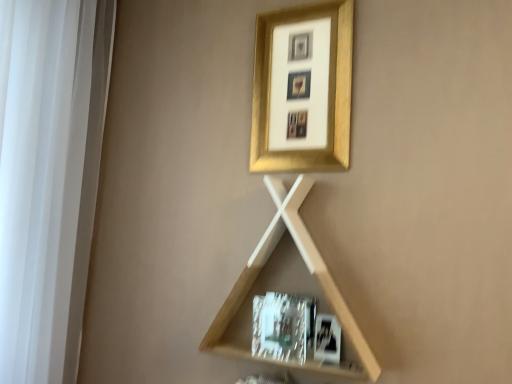
What is the approximate height of white fabric at left?

It is 1.11 meters.

What do you see at coordinates (327, 339) in the screenshot?
I see `metallic silver picture frame at lower right, the 1th picture frame when ordered from front to back` at bounding box center [327, 339].

The image size is (512, 384). Identify the location of metallic silver picture frame at lower right, the second picture frame in the back-to-front sequence. (327, 339).

Where is `gold metallic picture frame at upper center, positioned as the 1th picture frame in back-to-front order`? This screenshot has width=512, height=384. gold metallic picture frame at upper center, positioned as the 1th picture frame in back-to-front order is located at coordinates (303, 89).

Is gold metallic picture frame at upper center, the 2th picture frame in the bottom-to-top sequence, inside the boundaries of light wood/texture shelf at center, or outside?

gold metallic picture frame at upper center, the 2th picture frame in the bottom-to-top sequence, is outside light wood/texture shelf at center.

From the image's perspective, is gold metallic picture frame at upper center, which appears as the 1th picture frame when viewed from the top, located beneath light wood/texture shelf at center?

No.

Can you confirm if gold metallic picture frame at upper center, positioned as the second picture frame in front-to-back order, is taller than light wood/texture shelf at center?

In fact, gold metallic picture frame at upper center, positioned as the second picture frame in front-to-back order, may be shorter than light wood/texture shelf at center.

Does gold metallic picture frame at upper center, which appears as the 1th picture frame when viewed from the top, appear on the right side of light wood/texture shelf at center?

Correct, you'll find gold metallic picture frame at upper center, which appears as the 1th picture frame when viewed from the top, to the right of light wood/texture shelf at center.

Considering the points (70, 62) and (280, 52), which point is behind, point (70, 62) or point (280, 52)?

Point (70, 62)

Considering the positions of objects white fabric at left and gold metallic picture frame at upper center, which appears as the 1th picture frame when viewed from the top, in the image provided, who is more to the right, white fabric at left or gold metallic picture frame at upper center, which appears as the 1th picture frame when viewed from the top,?

From the viewer's perspective, gold metallic picture frame at upper center, which appears as the 1th picture frame when viewed from the top, appears more on the right side.

Considering the sizes of objects white fabric at left and gold metallic picture frame at upper center, positioned as the second picture frame in front-to-back order, in the image provided, who is thinner, white fabric at left or gold metallic picture frame at upper center, positioned as the second picture frame in front-to-back order,?

gold metallic picture frame at upper center, positioned as the second picture frame in front-to-back order.

From the picture: Who is shorter, white fabric at left or gold metallic picture frame at upper center, positioned as the second picture frame in front-to-back order?

With less height is gold metallic picture frame at upper center, positioned as the second picture frame in front-to-back order.

Considering the relative sizes of metallic silver picture frame at lower right, positioned as the 2th picture frame in top-to-bottom order, and gold metallic picture frame at upper center, positioned as the 1th picture frame in back-to-front order, in the image provided, is metallic silver picture frame at lower right, positioned as the 2th picture frame in top-to-bottom order, shorter than gold metallic picture frame at upper center, positioned as the 1th picture frame in back-to-front order,?

Indeed, metallic silver picture frame at lower right, positioned as the 2th picture frame in top-to-bottom order, has a lesser height compared to gold metallic picture frame at upper center, positioned as the 1th picture frame in back-to-front order.

Would you say metallic silver picture frame at lower right, the second picture frame in the back-to-front sequence, is a long distance from gold metallic picture frame at upper center, positioned as the second picture frame in front-to-back order?

metallic silver picture frame at lower right, the second picture frame in the back-to-front sequence, is near gold metallic picture frame at upper center, positioned as the second picture frame in front-to-back order, not far away.

You are a GUI agent. You are given a task and a screenshot of the screen. Output one action in this format:
    pyautogui.click(x=<x>, y=<y>)
    Task: Click on the picture frame on the left of metallic silver picture frame at lower right, the 1th picture frame when ordered from front to back
    The image size is (512, 384).
    Given the screenshot: What is the action you would take?
    pyautogui.click(x=303, y=89)

From a real-world perspective, between metallic silver picture frame at lower right, the second picture frame in the back-to-front sequence, and gold metallic picture frame at upper center, the 2th picture frame in the bottom-to-top sequence, who is vertically higher?

From a 3D spatial view, gold metallic picture frame at upper center, the 2th picture frame in the bottom-to-top sequence, is above.

Is metallic silver picture frame at lower right, positioned as the 2th picture frame in top-to-bottom order, surrounding light wood/texture shelf at center?

No.

From a real-world perspective, is metallic silver picture frame at lower right, positioned as the 2th picture frame in top-to-bottom order, positioned above or below light wood/texture shelf at center?

In terms of real-world spatial position, metallic silver picture frame at lower right, positioned as the 2th picture frame in top-to-bottom order, is below light wood/texture shelf at center.

How many degrees apart are the facing directions of metallic silver picture frame at lower right, the 1th picture frame when ordered from front to back, and light wood/texture shelf at center?

The angular difference between metallic silver picture frame at lower right, the 1th picture frame when ordered from front to back, and light wood/texture shelf at center is 0.000488 degrees.

Considering the sizes of objects gold metallic picture frame at upper center, positioned as the second picture frame in front-to-back order, and white fabric at left in the image provided, who is wider, gold metallic picture frame at upper center, positioned as the second picture frame in front-to-back order, or white fabric at left?

white fabric at left is wider.

Which is behind, gold metallic picture frame at upper center, the 2th picture frame in the bottom-to-top sequence, or white fabric at left?

gold metallic picture frame at upper center, the 2th picture frame in the bottom-to-top sequence, is further away from the camera.

Identify the location of window frame located underneath the gold metallic picture frame at upper center, positioned as the second picture frame in front-to-back order (from a real-world perspective). This screenshot has height=384, width=512. (49, 177).

Looking at this image, considering the relative sizes of gold metallic picture frame at upper center, positioned as the 1th picture frame in back-to-front order, and white fabric at left in the image provided, is gold metallic picture frame at upper center, positioned as the 1th picture frame in back-to-front order, taller than white fabric at left?

In fact, gold metallic picture frame at upper center, positioned as the 1th picture frame in back-to-front order, may be shorter than white fabric at left.

Would you say white fabric at left contains light wood/texture shelf at center?

Definitely not — light wood/texture shelf at center is not inside white fabric at left.

In the image, is white fabric at left on the left side or the right side of light wood/texture shelf at center?

In the image, white fabric at left appears on the left side of light wood/texture shelf at center.

Which of these two, white fabric at left or light wood/texture shelf at center, stands taller?

white fabric at left.

From the image's perspective, which is above, white fabric at left or light wood/texture shelf at center?

From the image's view, white fabric at left is above.

Considering the positions of point (312, 128) and point (318, 330), is point (312, 128) closer or farther from the camera than point (318, 330)?

Point (312, 128) appears to be farther away from the viewer than point (318, 330).

Between gold metallic picture frame at upper center, which appears as the 1th picture frame when viewed from the top, and metallic silver picture frame at lower right, which is the first picture frame from bottom to top, which one has more height?

Standing taller between the two is gold metallic picture frame at upper center, which appears as the 1th picture frame when viewed from the top.

Which is more to the left, gold metallic picture frame at upper center, which appears as the 1th picture frame when viewed from the top, or metallic silver picture frame at lower right, the 1th picture frame when ordered from front to back?

From the viewer's perspective, gold metallic picture frame at upper center, which appears as the 1th picture frame when viewed from the top, appears more on the left side.

Is gold metallic picture frame at upper center, which appears as the 1th picture frame when viewed from the top, oriented away from metallic silver picture frame at lower right, the second picture frame in the back-to-front sequence?

gold metallic picture frame at upper center, which appears as the 1th picture frame when viewed from the top, is not turned away from metallic silver picture frame at lower right, the second picture frame in the back-to-front sequence.

Locate an element on the screen. The width and height of the screenshot is (512, 384). shelf below the gold metallic picture frame at upper center, the 2th picture frame in the bottom-to-top sequence (from a real-world perspective) is located at coordinates (265, 290).

Locate an element on the screen. The image size is (512, 384). window frame that is below the gold metallic picture frame at upper center, positioned as the second picture frame in front-to-back order (from the image's perspective) is located at coordinates (49, 177).

Considering their positions, is metallic silver picture frame at lower right, the second picture frame in the back-to-front sequence, positioned closer to white fabric at left than light wood/texture shelf at center?

light wood/texture shelf at center lies closer to white fabric at left than the other object.

From the image, which object appears to be nearer to white fabric at left, gold metallic picture frame at upper center, positioned as the second picture frame in front-to-back order, or metallic silver picture frame at lower right, positioned as the 2th picture frame in top-to-bottom order?

gold metallic picture frame at upper center, positioned as the second picture frame in front-to-back order, is positioned closer to the anchor white fabric at left.

Based on their spatial positions, is gold metallic picture frame at upper center, the 2th picture frame in the bottom-to-top sequence, or white fabric at left closer to metallic silver picture frame at lower right, positioned as the 2th picture frame in top-to-bottom order?

gold metallic picture frame at upper center, the 2th picture frame in the bottom-to-top sequence, is closer to metallic silver picture frame at lower right, positioned as the 2th picture frame in top-to-bottom order.

When comparing their distances from white fabric at left, does light wood/texture shelf at center or gold metallic picture frame at upper center, which appears as the 1th picture frame when viewed from the top, seem closer?

light wood/texture shelf at center is closer to white fabric at left.

When comparing their distances from white fabric at left, does metallic silver picture frame at lower right, the 1th picture frame when ordered from front to back, or gold metallic picture frame at upper center, the 2th picture frame in the bottom-to-top sequence, seem further?

Based on the image, metallic silver picture frame at lower right, the 1th picture frame when ordered from front to back, appears to be further to white fabric at left.

Considering their positions, is white fabric at left positioned further to light wood/texture shelf at center than gold metallic picture frame at upper center, the 2th picture frame in the bottom-to-top sequence?

white fabric at left is positioned further to the anchor light wood/texture shelf at center.

Considering their positions, is light wood/texture shelf at center positioned further to white fabric at left than metallic silver picture frame at lower right, positioned as the 2th picture frame in top-to-bottom order?

metallic silver picture frame at lower right, positioned as the 2th picture frame in top-to-bottom order, is further to white fabric at left.

In the scene shown: Considering their positions, is metallic silver picture frame at lower right, the second picture frame in the back-to-front sequence, positioned further to gold metallic picture frame at upper center, positioned as the second picture frame in front-to-back order, than white fabric at left?

white fabric at left is further to gold metallic picture frame at upper center, positioned as the second picture frame in front-to-back order.

At what (x,y) coordinates should I click in order to perform the action: click on shelf between gold metallic picture frame at upper center, positioned as the second picture frame in front-to-back order, and metallic silver picture frame at lower right, the 1th picture frame when ordered from front to back, in the up-down direction. Please return your answer as a coordinate pair (x, y). This screenshot has width=512, height=384. Looking at the image, I should click on (265, 290).

Identify the location of picture frame situated between white fabric at left and metallic silver picture frame at lower right, the second picture frame in the back-to-front sequence, from left to right. Image resolution: width=512 pixels, height=384 pixels. (303, 89).

This screenshot has height=384, width=512. Find the location of `shelf between white fabric at left and metallic silver picture frame at lower right, positioned as the 2th picture frame in top-to-bottom order, in the horizontal direction`. shelf between white fabric at left and metallic silver picture frame at lower right, positioned as the 2th picture frame in top-to-bottom order, in the horizontal direction is located at coordinates (265, 290).

Locate an element on the screen. shelf between white fabric at left and gold metallic picture frame at upper center, positioned as the 1th picture frame in back-to-front order is located at coordinates (265, 290).